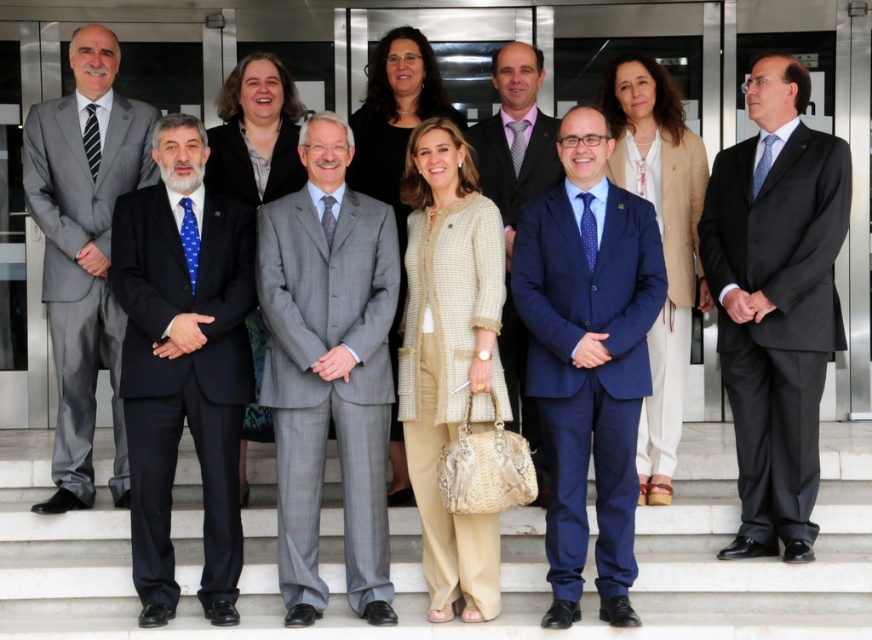
Looking at this image, you are an event photographer trying to capture a clear shot of the matte purple tie at center and the beige textured coat at center. Based on their positions, which object is closer to the camera?

The matte purple tie at center is below the beige textured coat at center, so the beige textured coat at center is closer to the camera.

You are an event planner arranging a photo shoot for the group on the steps. The photographer wants to ensure that the gray checkered suit at center and the matte purple tie at center are both visible in the frame. Given their sizes, which object should be placed closer to the camera to ensure both are clearly visible?

The gray checkered suit at center is smaller in size compared to the matte purple tie at center. To ensure both are clearly visible, the gray checkered suit at center should be placed closer to the camera since its smaller size requires it to be nearer for clarity, while the larger matte purple tie at center can be slightly farther back and still remain visible.